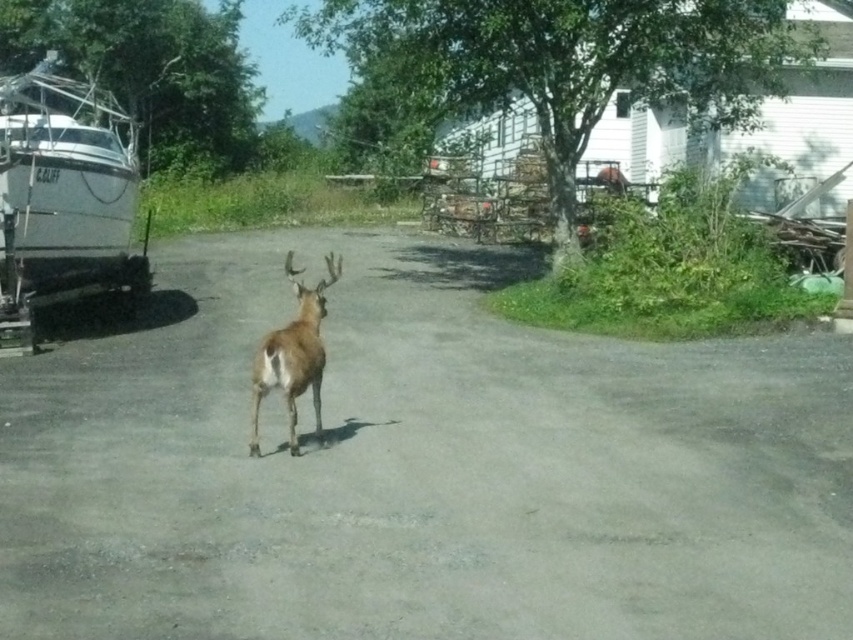
Based on the photo, you are standing at the boat parked on the trailer to the left of the image. You want to walk to the white house partially obscured by trees and foliage. Which direction should you head relative to the gray asphalt driveway at center?

You should head towards the gray asphalt driveway at center since it is located at point (421, 467), which is closer to the direction of the white house compared to your current position at the boat on the left.